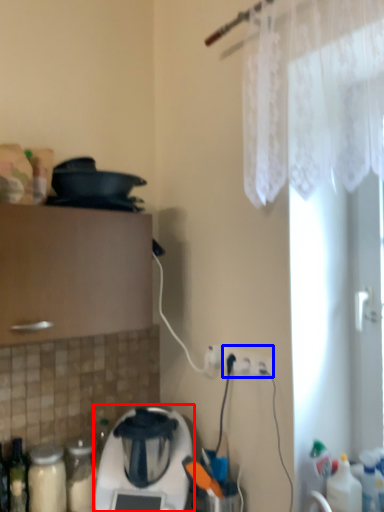
Question: Among these objects, which one is nearest to the camera, home appliance (highlighted by a red box) or electric outlet (highlighted by a blue box)?

Choices:
 (A) home appliance
 (B) electric outlet

Answer: (A)